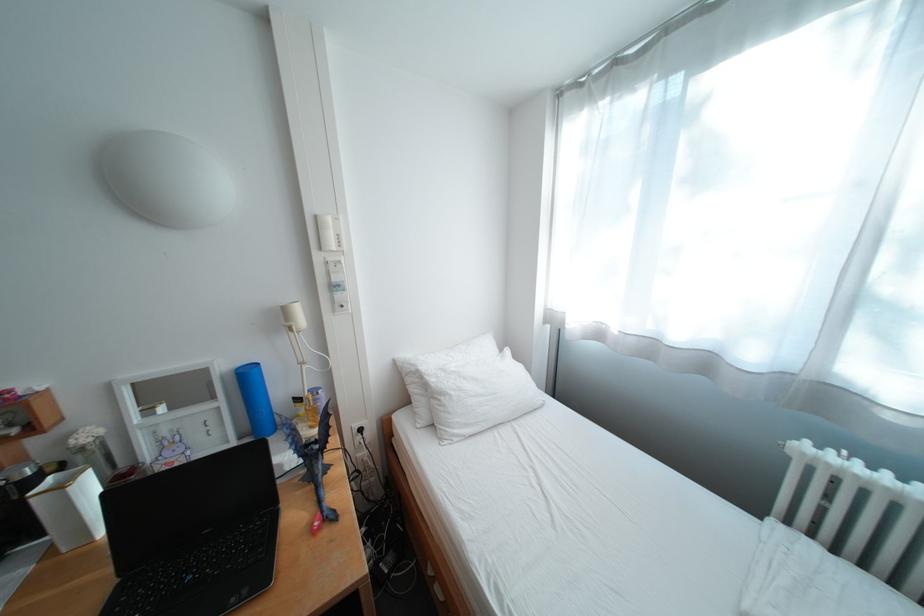
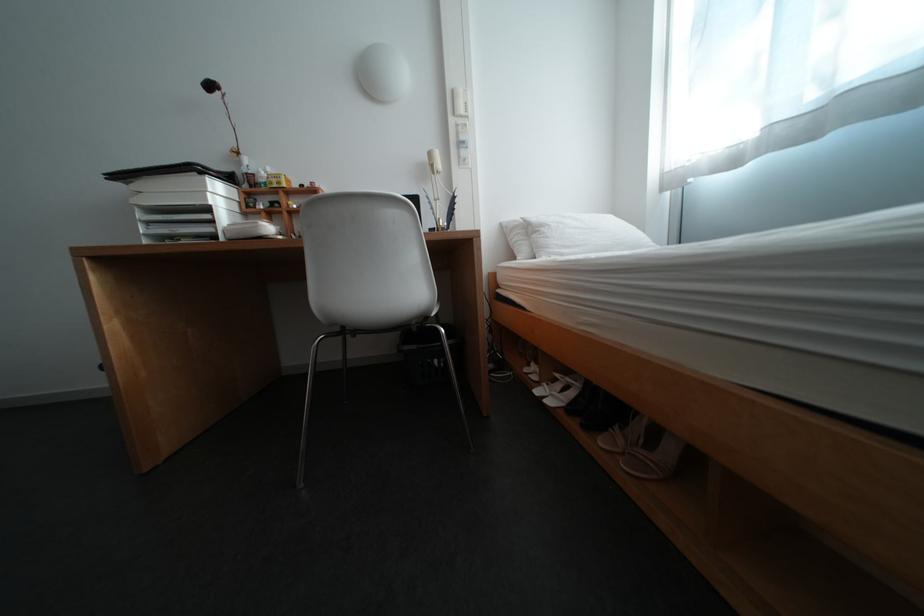
The point at (456, 397) is marked in the first image. Where is the corresponding point in the second image?

(555, 228)